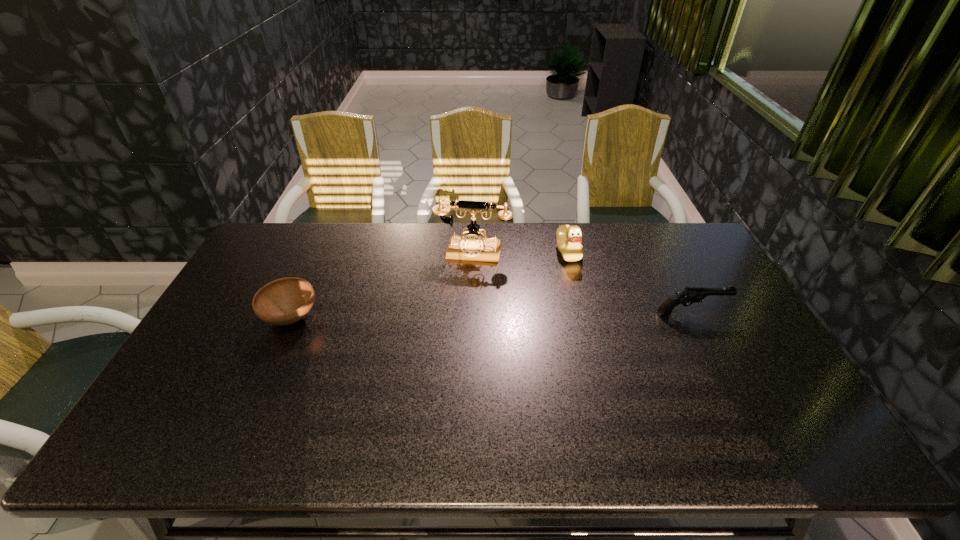
I want to click on bowl, so click(x=284, y=301).

I want to click on the shortest object, so click(x=284, y=301).

Image resolution: width=960 pixels, height=540 pixels. I want to click on the rightmost object, so click(690, 295).

Find the location of a particular element. This screenshot has width=960, height=540. gun is located at coordinates pos(690,295).

You are a GUI agent. You are given a task and a screenshot of the screen. Output one action in this format:
    pyautogui.click(x=<x>, y=<y>)
    Task: Click on the tallest object
    Image resolution: width=960 pixels, height=540 pixels.
    Given the screenshot: What is the action you would take?
    pyautogui.click(x=473, y=247)

Where is `telephone`? This screenshot has width=960, height=540. telephone is located at coordinates (473, 247).

In order to click on duck in this screenshot , I will do `click(569, 238)`.

Locate an element on the screen. The image size is (960, 540). vacant space located 0.200m on the back of the shortest object is located at coordinates (318, 258).

The image size is (960, 540). In order to click on free region located 0.050m at the end of the barrel of the third tallest object in this screenshot , I will do `click(741, 314)`.

Find the location of a particular element. This screenshot has height=540, width=960. vacant space located 0.320m on the dial of the tallest object is located at coordinates (449, 335).